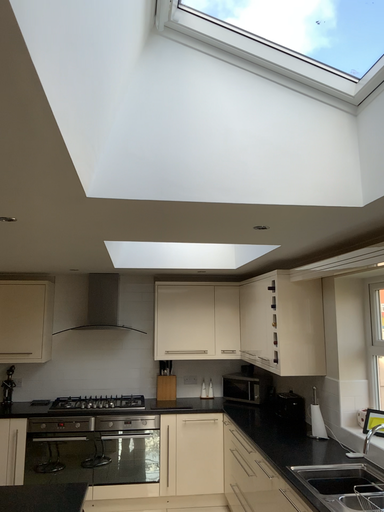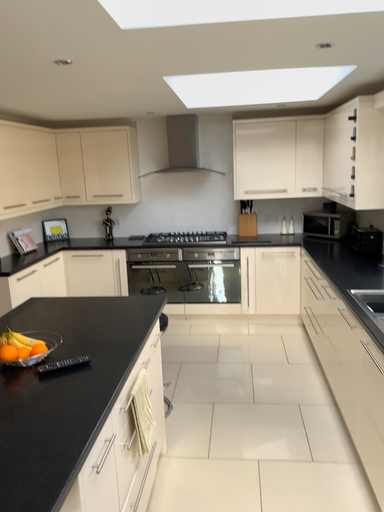
Question: How did the camera likely rotate when shooting the video?

Choices:
 (A) rotated upward
 (B) rotated downward

Answer: (B)